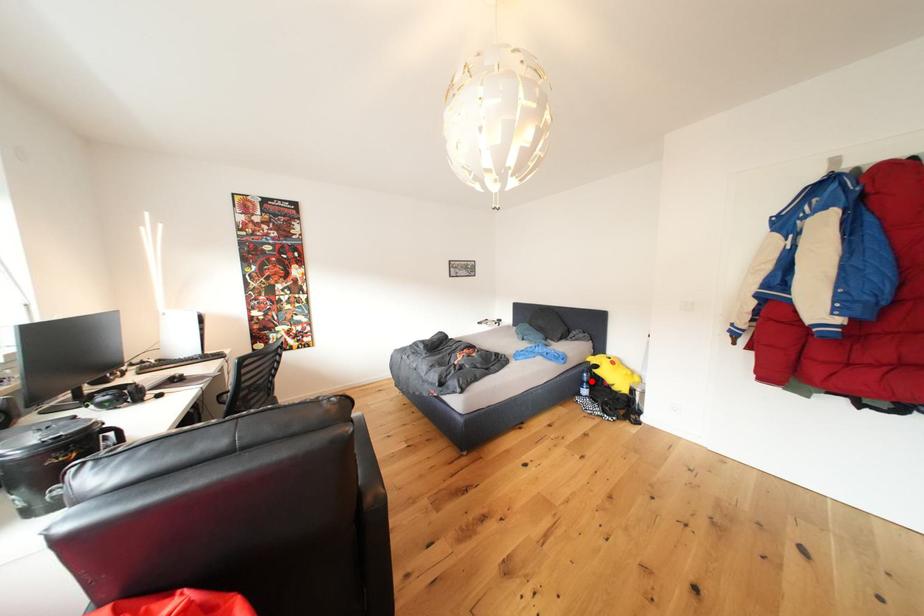
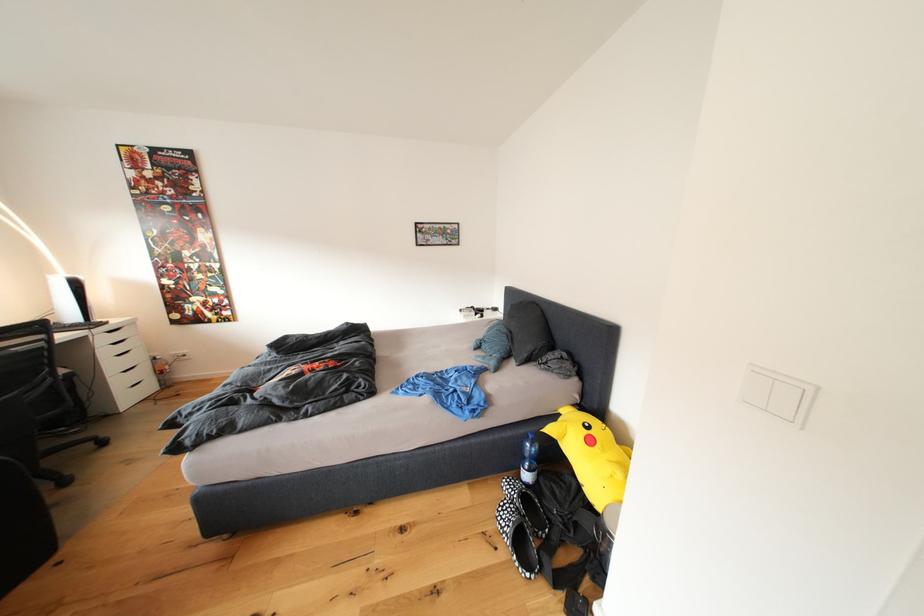
In the second image, find the point that corresponds to the highlighted location in the first image.

(531, 451)